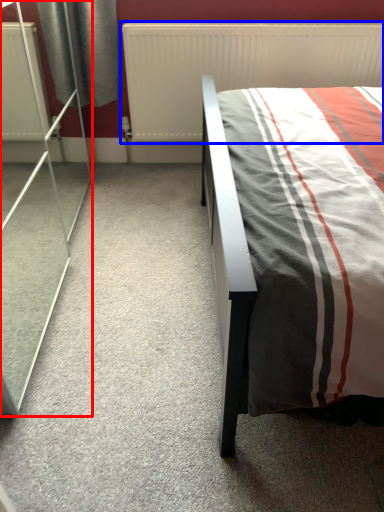
Question: Among these objects, which one is farthest to the camera, screen door (highlighted by a red box) or radiator (highlighted by a blue box)?

Choices:
 (A) screen door
 (B) radiator

Answer: (B)